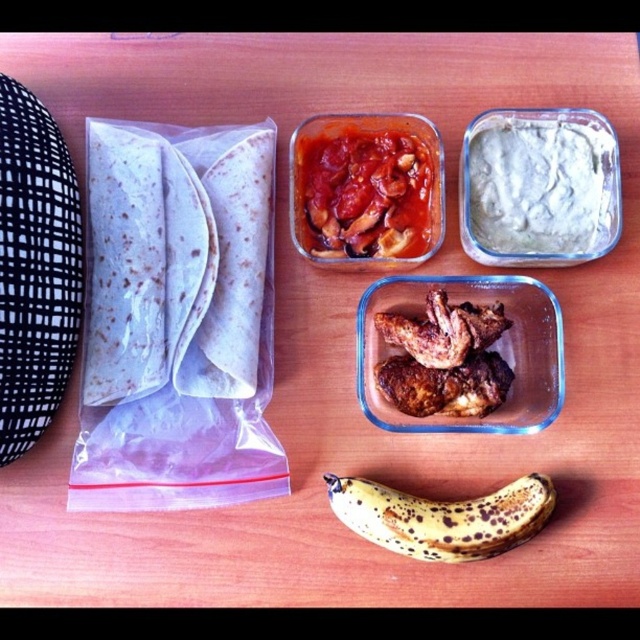
You are preparing a meal and need to assemble a taco. You have the white flour tortillas at left and the green creamy dip at upper right. Which item is located lower on the wooden surface?

The white flour tortillas at left is located below the green creamy dip at upper right, so it is lower on the wooden surface.

Based on the coordinates provided, which object is located at point (x=176, y=260)?

The point (x=176, y=260) corresponds to the white flour tortillas at left.